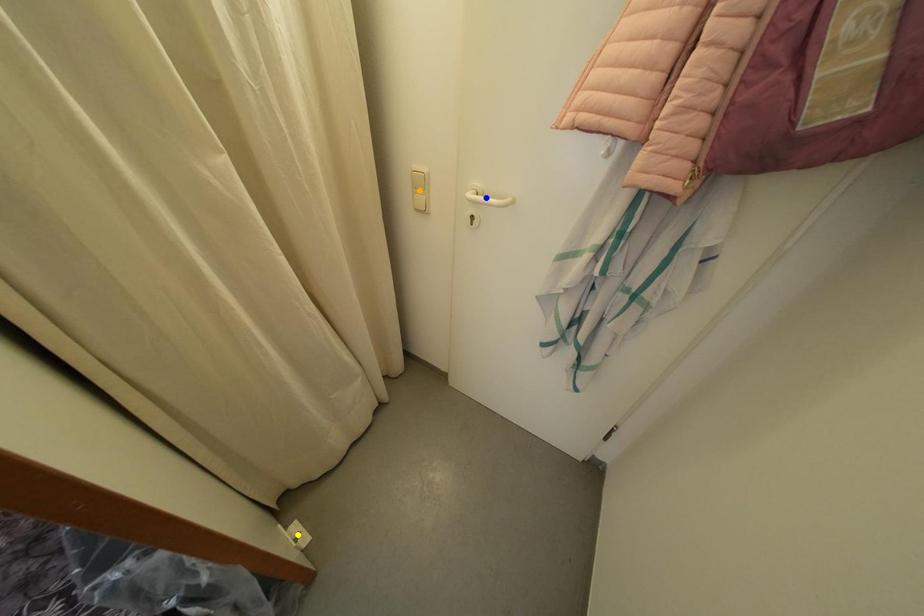
Order these from nearest to farthest:
- blue point
- yellow point
- orange point

blue point < orange point < yellow point